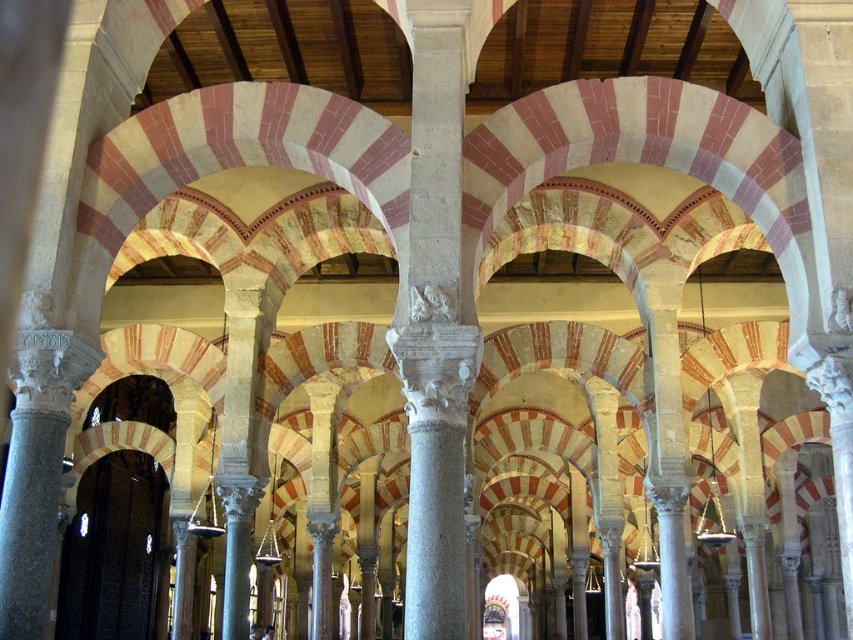
You are standing in the grand architectural space and want to take a photo of both the smooth stone column at center and the gray stone column at center. Which column should you position yourself to the left of to capture both in the frame?

You should position yourself to the left of the gray stone column at center because the smooth stone column at center is to the right of it, so both will be in the frame when you stand there.

You are an architect examining the interior of a grand space. You notice two columns at the center of the scene. Based on their widths, which column would you say is more slender between the smooth stone column at center and the gray stone column at center?

→ The smooth stone column at center is more slender because it has a lesser width compared to the gray stone column at center.

You are standing in the grand architectural space and want to move from the point at coordinates point (440, 189) to the point at coordinates point (241, 593). Which direction should you move to get closer to your destination?

To move from point (440, 189) to point 0.927, 0824, you should move towards the lower right direction since point (241, 593) is farther from the camera compared to point (440, 189).